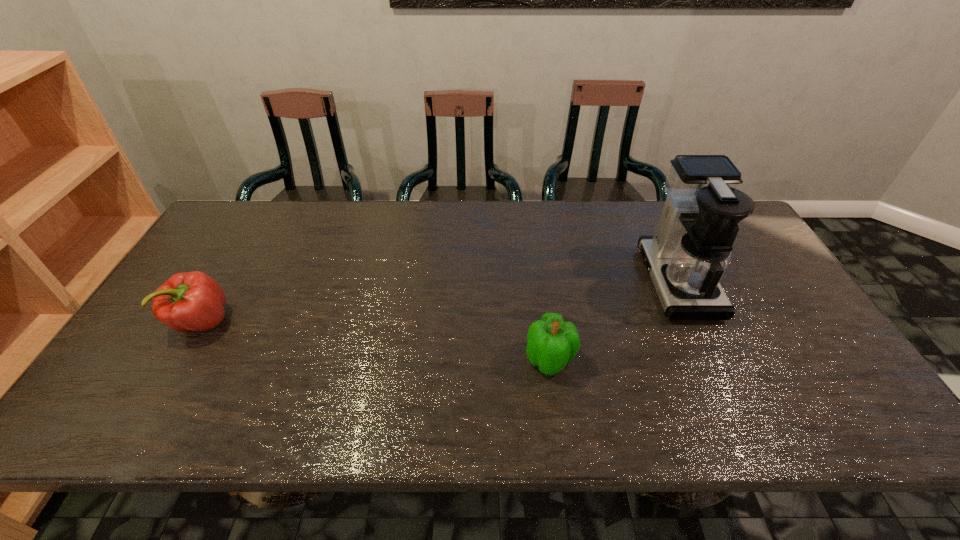
The image size is (960, 540). I want to click on blank area in the image that satisfies the following two spatial constraints: 1. at the front of the coffee maker where the controls are located; 2. on the front side of the leftmost object, so click(x=696, y=322).